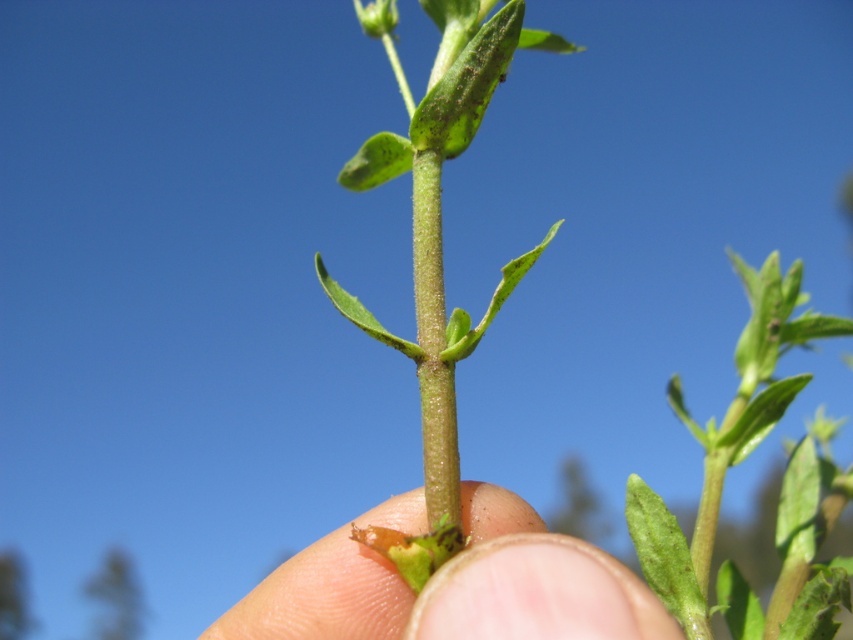
Can you confirm if smooth skin at center is shorter than green matte leaf at center?

Yes, smooth skin at center is shorter than green matte leaf at center.

Which is in front, point (527, 579) or point (802, 296)?

Point (527, 579) is more forward.

Where is `smooth skin at center`? This screenshot has height=640, width=853. smooth skin at center is located at coordinates (454, 588).